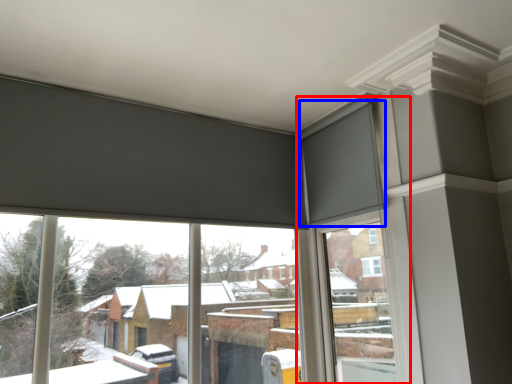
Question: Which point is further to the camera, window frame (highlighted by a red box) or curtain (highlighted by a blue box)?

Choices:
 (A) window frame
 (B) curtain

Answer: (B)